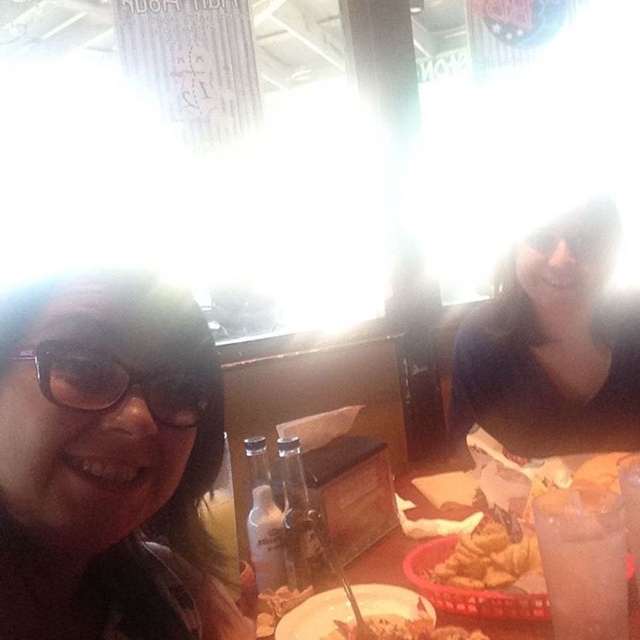
You are a server at the dining table and need to place a new order on the table. The order requires placing a dish on the white matte plate at center without disturbing the transparent plastic goggles at upper center. Is this possible?

The white matte plate at center is positioned under transparent plastic goggles at upper center, so placing a dish on the white matte plate at center would require moving the goggles first to avoid disturbing them.

You are setting up a small dinner party and need to place a decorative item on the table. You have a white matte plate at center and a transparent plastic goggles at upper center. Which item should you choose if you want something larger to hold appetizers?

The white matte plate at center is bigger than the transparent plastic goggles at upper center, so you should choose the white matte plate at center to hold appetizers.

You are a server at a restaurant and need to place a new order on the table. The order includes a salad that needs to be placed to the right of the transparent plastic goggles at upper center. Where should you place the salad plate relative to the white matte plate at center?

The salad plate should be placed to the right of the transparent plastic goggles at upper center, which is to the right of the white matte plate at center since the white matte plate at center is to the left of the goggles.